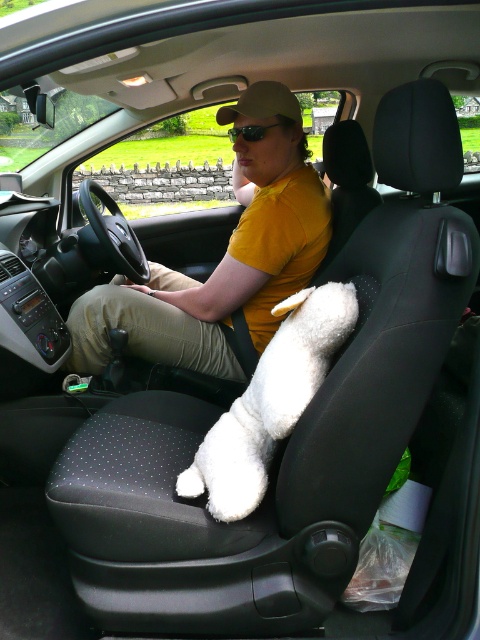
Does yellow matte shirt at center lie in front of green reflective lens glasses at center?

Yes, it is.

This screenshot has height=640, width=480. What do you see at coordinates (223, 257) in the screenshot? I see `yellow matte shirt at center` at bounding box center [223, 257].

This screenshot has height=640, width=480. I want to click on yellow matte shirt at center, so click(223, 257).

Is khaki fabric pants at center above green reflective lens glasses at center?

No.

Is khaki fabric pants at center wider than green reflective lens glasses at center?

Yes, khaki fabric pants at center is wider than green reflective lens glasses at center.

Locate an element on the screen. khaki fabric pants at center is located at coordinates (144, 332).

This screenshot has height=640, width=480. Identify the location of khaki fabric pants at center. (144, 332).

In the scene shown: Between white fluffy dog at center and khaki fabric pants at center, which one appears on the left side from the viewer's perspective?

Positioned to the left is khaki fabric pants at center.

Can you confirm if white fluffy dog at center is shorter than khaki fabric pants at center?

Incorrect, white fluffy dog at center's height does not fall short of khaki fabric pants at center's.

Locate an element on the screen. This screenshot has height=640, width=480. white fluffy dog at center is located at coordinates point(269,401).

Locate an element on the screen. Image resolution: width=480 pixels, height=640 pixels. white fluffy dog at center is located at coordinates (269, 401).